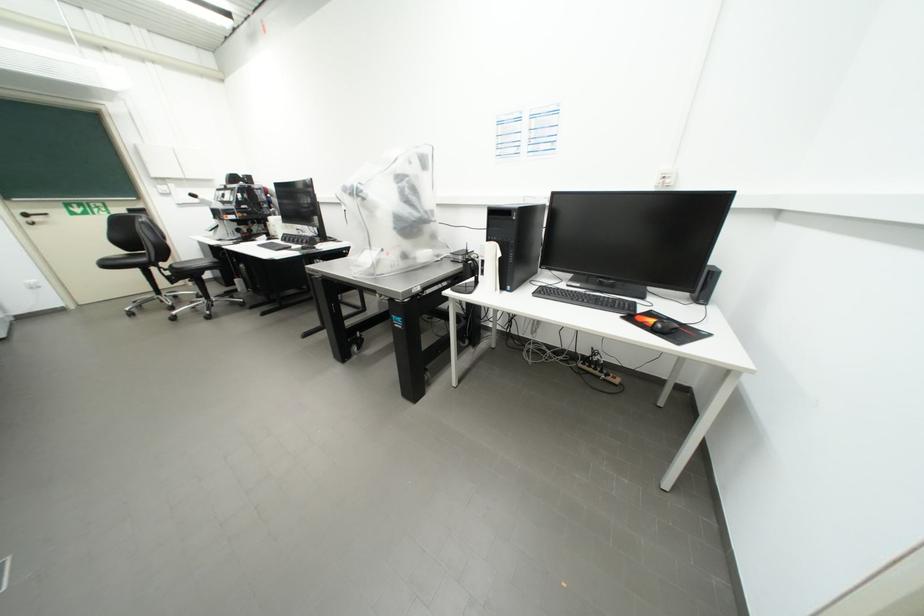
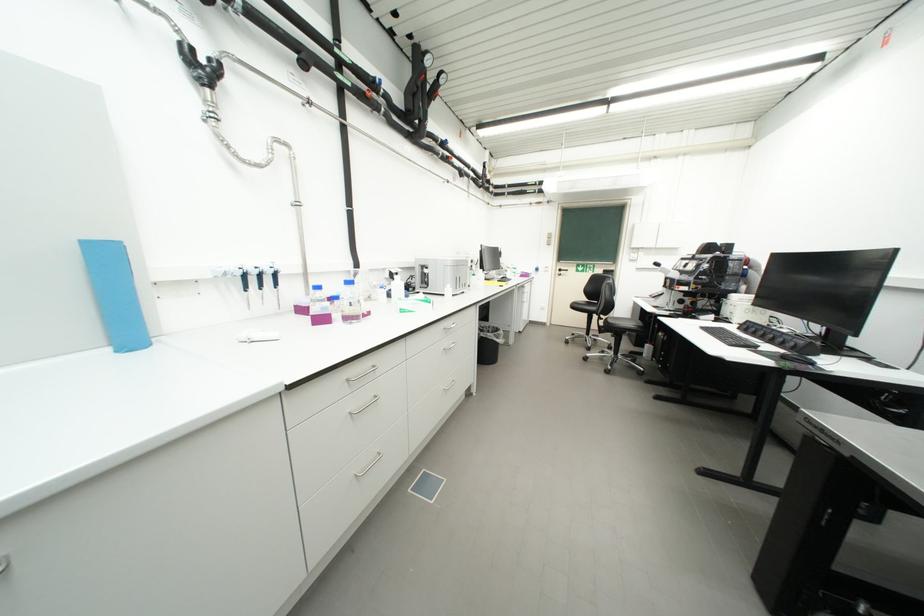
The point at (310, 251) is marked in the first image. Where is the corresponding point in the second image?

(792, 359)